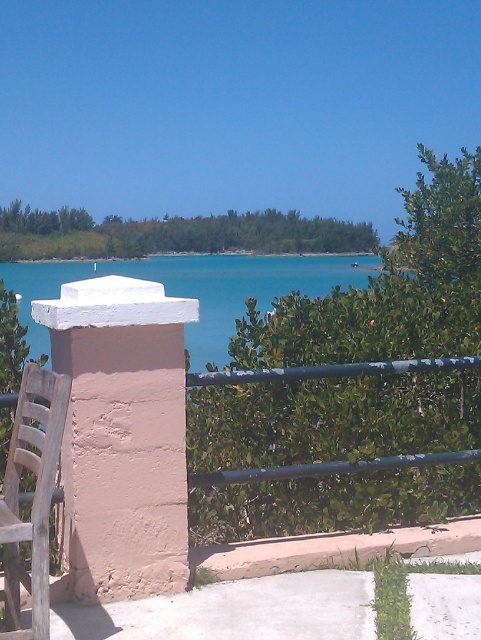
Question: Which of the following is the closest to the observer?

Choices:
 (A) coord(27,397)
 (B) coord(12,289)

Answer: (A)

Question: Considering the relative positions of teal water at center and wooden slats chair at lower left in the image provided, where is teal water at center located with respect to wooden slats chair at lower left?

Choices:
 (A) below
 (B) above

Answer: (B)

Question: Where is teal water at center located in relation to wooden slats chair at lower left in the image?

Choices:
 (A) above
 (B) below

Answer: (A)

Question: Which point is farther from the camera taking this photo?

Choices:
 (A) (211, 292)
 (B) (54, 378)

Answer: (A)

Question: Among these points, which one is nearest to the camera?

Choices:
 (A) (27, 538)
 (B) (318, 273)

Answer: (A)

Question: Is teal water at center below wooden slats chair at lower left?

Choices:
 (A) no
 (B) yes

Answer: (A)